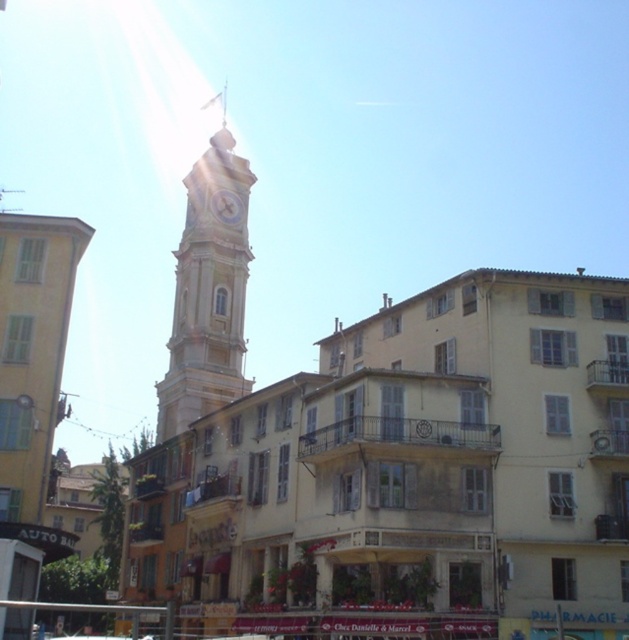
Question: From the image, what is the correct spatial relationship of light beige stone clock tower at center in relation to white glossy clock at center?

Choices:
 (A) above
 (B) below

Answer: (A)

Question: Which point is farther to the camera?

Choices:
 (A) light beige stone clock tower at center
 (B) white glossy clock at center

Answer: (B)

Question: Does light beige stone clock tower at center lie in front of white glossy clock at center?

Choices:
 (A) yes
 (B) no

Answer: (A)

Question: Which object appears farthest from the camera in this image?

Choices:
 (A) light beige stone clock tower at center
 (B) white glossy clock at center

Answer: (B)

Question: Is light beige stone clock tower at center further to camera compared to white glossy clock at center?

Choices:
 (A) no
 (B) yes

Answer: (A)